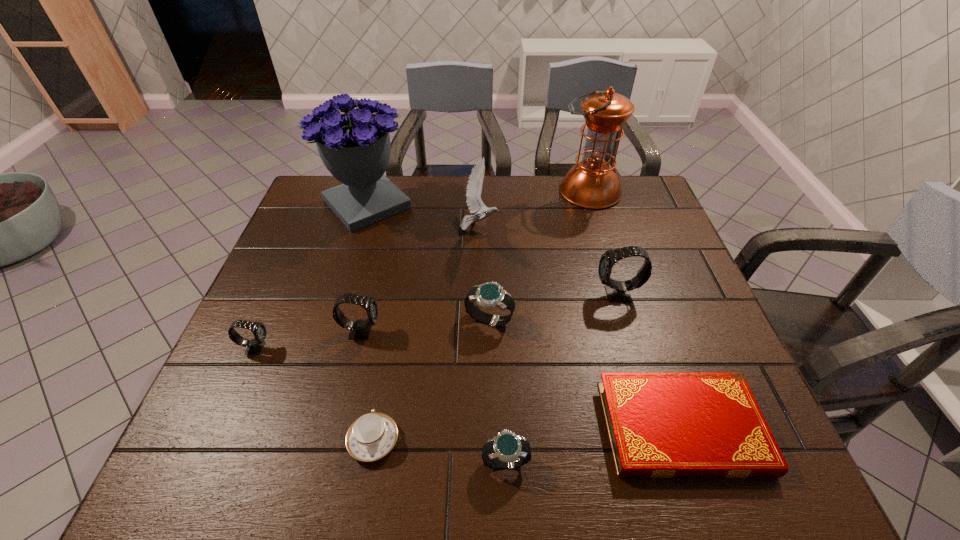
The height and width of the screenshot is (540, 960). In order to click on oil lamp in this screenshot , I will do `click(592, 183)`.

The height and width of the screenshot is (540, 960). What are the coordinates of `purple bouquet` in the screenshot? It's located at (355, 147).

Locate an element on the screen. The height and width of the screenshot is (540, 960). white gull is located at coordinates click(x=474, y=202).

The height and width of the screenshot is (540, 960). Find the location of `the farthest watch`. the farthest watch is located at coordinates (617, 291).

You are a GUI agent. You are given a task and a screenshot of the screen. Output one action in this format:
    pyautogui.click(x=<x>, y=<y>)
    Task: Click on the seventh nearest object
    The image size is (960, 540).
    Given the screenshot: What is the action you would take?
    pyautogui.click(x=617, y=291)

Locate an element on the screen. The width and height of the screenshot is (960, 540). the second smallest gray watch is located at coordinates (360, 329).

Locate an element on the screen. the second gray watch from right to left is located at coordinates (360, 329).

Identify the location of the bigger silver watch. (488, 295).

Where is `the leftmost watch`? The height and width of the screenshot is (540, 960). the leftmost watch is located at coordinates click(x=254, y=346).

Locate an element on the screen. the smallest gray watch is located at coordinates (254, 346).